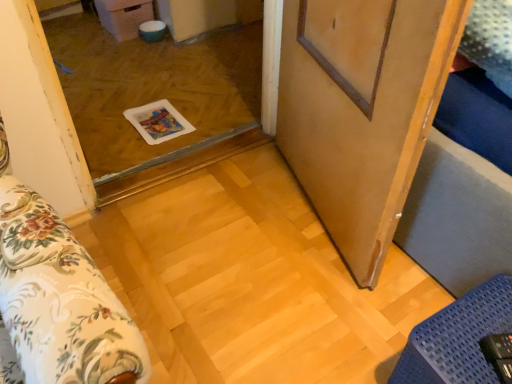
Question: Considering the relative sizes of wooden barn door at center and blue textured mat at lower right in the image provided, is wooden barn door at center wider than blue textured mat at lower right?

Choices:
 (A) yes
 (B) no

Answer: (B)

Question: Is wooden barn door at center next to blue textured mat at lower right and touching it?

Choices:
 (A) no
 (B) yes

Answer: (A)

Question: Is the depth of wooden barn door at center greater than that of blue textured mat at lower right?

Choices:
 (A) yes
 (B) no

Answer: (B)

Question: Can you confirm if wooden barn door at center is shorter than blue textured mat at lower right?

Choices:
 (A) no
 (B) yes

Answer: (A)

Question: From the image's perspective, is wooden barn door at center under blue textured mat at lower right?

Choices:
 (A) yes
 (B) no

Answer: (B)

Question: Is wooden barn door at center oriented towards blue textured mat at lower right?

Choices:
 (A) yes
 (B) no

Answer: (B)

Question: From a real-world perspective, is transparent plastic tray at center physically below wooden barn door at center?

Choices:
 (A) yes
 (B) no

Answer: (A)

Question: Is transparent plastic tray at center further to the viewer compared to wooden barn door at center?

Choices:
 (A) no
 (B) yes

Answer: (B)

Question: Can wooden barn door at center be found inside transparent plastic tray at center?

Choices:
 (A) yes
 (B) no

Answer: (B)

Question: Does transparent plastic tray at center have a smaller size compared to wooden barn door at center?

Choices:
 (A) yes
 (B) no

Answer: (A)

Question: Can you confirm if transparent plastic tray at center is taller than wooden barn door at center?

Choices:
 (A) no
 (B) yes

Answer: (A)

Question: Is transparent plastic tray at center located outside wooden barn door at center?

Choices:
 (A) no
 (B) yes

Answer: (B)

Question: Can you confirm if transparent plastic tray at center is smaller than blue textured mat at lower right?

Choices:
 (A) yes
 (B) no

Answer: (B)